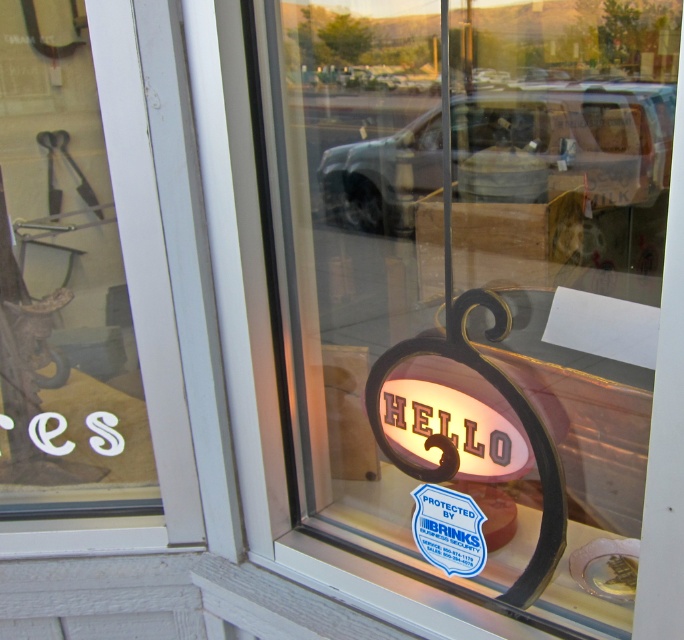
Question: Can you confirm if matte glass sign at center is bigger than white frosted glass at left?

Choices:
 (A) no
 (B) yes

Answer: (B)

Question: Where is matte glass sign at center located in relation to white frosted glass at left in the image?

Choices:
 (A) left
 (B) right

Answer: (B)

Question: Is matte glass sign at center smaller than white frosted glass at left?

Choices:
 (A) no
 (B) yes

Answer: (A)

Question: Which of the following is the farthest from the observer?

Choices:
 (A) (111, 436)
 (B) (529, 269)

Answer: (B)